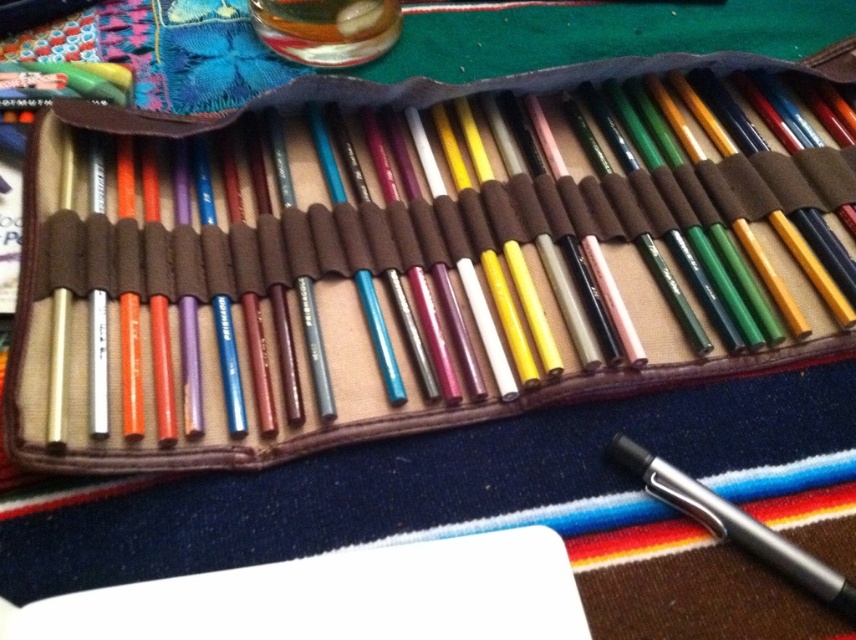
Based on the photo, is white paper at lower center to the right of metallic silver pen at lower right from the viewer's perspective?

No, white paper at lower center is not to the right of metallic silver pen at lower right.

Who is positioned more to the left, white paper at lower center or metallic silver pen at lower right?

white paper at lower center is more to the left.

Which is in front, point (236, 609) or point (642, 483)?

Point (236, 609)

Locate an element on the screen. white paper at lower center is located at coordinates (337, 596).